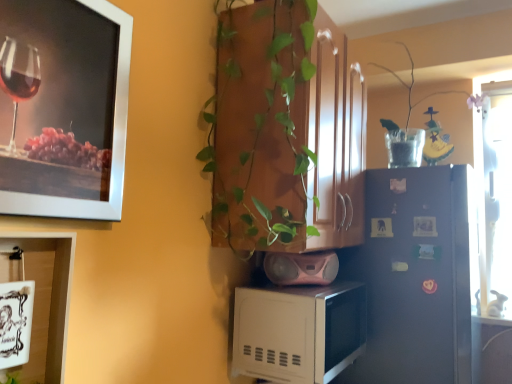
Question: From a real-world perspective, is satin blue refrigerator at center right positioned above or below white matte microwave at lower center?

Choices:
 (A) below
 (B) above

Answer: (B)

Question: Relative to white matte microwave at lower center, is satin blue refrigerator at center right in front or behind?

Choices:
 (A) behind
 (B) front

Answer: (A)

Question: Estimate the real-world distances between objects in this image. Which object is closer to the satin blue refrigerator at center right?

Choices:
 (A) pink plastic speaker at lower center
 (B) metallic silver picture frame at upper left, the 2th picture frame from the bottom
 (C) white matte microwave at lower center
 (D) green glossy plant at center
 (E) white ceramic mug at lower left, acting as the first picture frame starting from the bottom

Answer: (A)

Question: Which is nearer to the white glossy cabinet at lower left?

Choices:
 (A) satin blue refrigerator at center right
 (B) white matte microwave at lower center
 (C) green glossy plant at center
 (D) metallic silver picture frame at upper left, arranged as the first picture frame when viewed from the top
 (E) pink plastic speaker at lower center

Answer: (D)